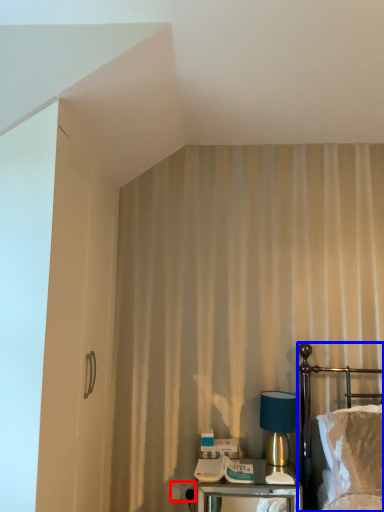
Question: Which object appears farthest to the camera in this image, electric outlet (highlighted by a red box) or bed (highlighted by a blue box)?

Choices:
 (A) electric outlet
 (B) bed

Answer: (A)